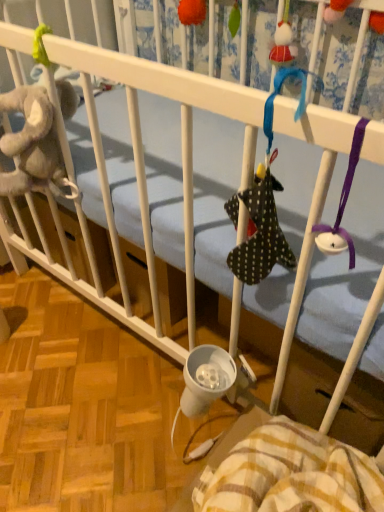
At what (x,y) coordinates should I click in order to perform the action: click on orange fuzzy ball at upper center, the first toy from the back. Please return your answer as a coordinate pair (x, y). The height and width of the screenshot is (512, 384). Looking at the image, I should click on (192, 12).

Describe the element at coordinates (192, 12) in the screenshot. The height and width of the screenshot is (512, 384). I see `orange fuzzy ball at upper center, the 2th toy when ordered from front to back` at that location.

Locate an element on the screen. yellow plaid blanket at lower right is located at coordinates (291, 474).

You are a GUI agent. You are given a task and a screenshot of the screen. Output one action in this format:
    pyautogui.click(x=<x>, y=<y>)
    Task: Click on the orange fuzzy ball at upper center, the 2th toy when ordered from front to back
    This screenshot has width=384, height=512.
    Given the screenshot: What is the action you would take?
    pyautogui.click(x=192, y=12)

From the image's perspective, would you say orange fuzzy ball at upper center, marked as the second toy in a right-to-left arrangement, is positioned over yellow plaid blanket at lower right?

Yes.

Considering the relative sizes of orange fuzzy ball at upper center, placed as the second toy when sorted from bottom to top, and yellow plaid blanket at lower right in the image provided, is orange fuzzy ball at upper center, placed as the second toy when sorted from bottom to top, wider than yellow plaid blanket at lower right?

No.

From a real-world perspective, is orange fuzzy ball at upper center, the first toy from the back, beneath yellow plaid blanket at lower right?

Incorrect, from a real-world perspective, orange fuzzy ball at upper center, the first toy from the back, is higher than yellow plaid blanket at lower right.

Who is shorter, orange fuzzy ball at upper center, the 2th toy when ordered from front to back, or yellow plaid blanket at lower right?

orange fuzzy ball at upper center, the 2th toy when ordered from front to back.

Is polka dot fabric sock at upper center, the second toy positioned from the top, in contact with yellow plaid blanket at lower right?

No, polka dot fabric sock at upper center, the second toy positioned from the top, is not touching yellow plaid blanket at lower right.

Considering the relative sizes of polka dot fabric sock at upper center, the second toy from the left, and yellow plaid blanket at lower right in the image provided, is polka dot fabric sock at upper center, the second toy from the left, shorter than yellow plaid blanket at lower right?

Correct, polka dot fabric sock at upper center, the second toy from the left, is not as tall as yellow plaid blanket at lower right.

Is yellow plaid blanket at lower right surrounded by polka dot fabric sock at upper center, the second toy from the left?

That's incorrect, yellow plaid blanket at lower right is not inside polka dot fabric sock at upper center, the second toy from the left.

Based on the photo, considering the sizes of objects polka dot fabric sock at upper center, which ranks as the 2th toy in back-to-front order, and yellow plaid blanket at lower right in the image provided, who is thinner, polka dot fabric sock at upper center, which ranks as the 2th toy in back-to-front order, or yellow plaid blanket at lower right?

With smaller width is polka dot fabric sock at upper center, which ranks as the 2th toy in back-to-front order.

Looking at this image, could orange fuzzy ball at upper center, which is counted as the 1th toy, starting from the top, be considered to be inside polka dot fabric sock at upper center, which ranks as the 2th toy in back-to-front order?

Definitely not — orange fuzzy ball at upper center, which is counted as the 1th toy, starting from the top, is not inside polka dot fabric sock at upper center, which ranks as the 2th toy in back-to-front order.

Between polka dot fabric sock at upper center, the second toy positioned from the top, and orange fuzzy ball at upper center, the 2th toy when ordered from front to back, which one appears on the right side from the viewer's perspective?

polka dot fabric sock at upper center, the second toy positioned from the top, is more to the right.

Is polka dot fabric sock at upper center, the second toy from the left, in front of orange fuzzy ball at upper center, the first toy from the back?

Yes, the depth of polka dot fabric sock at upper center, the second toy from the left, is less than that of orange fuzzy ball at upper center, the first toy from the back.

Could you tell me if polka dot fabric sock at upper center, which is counted as the 1th toy, starting from the front, is turned towards orange fuzzy ball at upper center, the 2th toy when ordered from front to back?

No, polka dot fabric sock at upper center, which is counted as the 1th toy, starting from the front, is not oriented towards orange fuzzy ball at upper center, the 2th toy when ordered from front to back.

Is polka dot fabric sock at upper center, the second toy positioned from the top, at the back of orange fuzzy ball at upper center, the first toy positioned from the left?

orange fuzzy ball at upper center, the first toy positioned from the left, is not turned away from polka dot fabric sock at upper center, the second toy positioned from the top.

From the picture: Is orange fuzzy ball at upper center, the first toy from the back, far from polka dot fabric sock at upper center, the first toy ordered from the bottom?

No, there isn't a large distance between orange fuzzy ball at upper center, the first toy from the back, and polka dot fabric sock at upper center, the first toy ordered from the bottom.

Is orange fuzzy ball at upper center, which is counted as the 1th toy, starting from the top, to the left of polka dot fabric sock at upper center, the second toy positioned from the top, from the viewer's perspective?

Indeed, orange fuzzy ball at upper center, which is counted as the 1th toy, starting from the top, is positioned on the left side of polka dot fabric sock at upper center, the second toy positioned from the top.

Which object is further away from the camera taking this photo, orange fuzzy ball at upper center, which is counted as the 1th toy, starting from the top, or polka dot fabric sock at upper center, the second toy from the left?

orange fuzzy ball at upper center, which is counted as the 1th toy, starting from the top, is behind.

Is yellow plaid blanket at lower right thinner than orange fuzzy ball at upper center, placed as the second toy when sorted from bottom to top?

No.

Considering the sizes of objects yellow plaid blanket at lower right and orange fuzzy ball at upper center, marked as the second toy in a right-to-left arrangement, in the image provided, who is bigger, yellow plaid blanket at lower right or orange fuzzy ball at upper center, marked as the second toy in a right-to-left arrangement,?

yellow plaid blanket at lower right.

Locate an element on the screen. This screenshot has width=384, height=512. the 2nd toy positioned above the yellow plaid blanket at lower right (from a real-world perspective) is located at coordinates (192, 12).

Which is more to the left, yellow plaid blanket at lower right or polka dot fabric sock at upper center, which ranks as the 2th toy in back-to-front order?

yellow plaid blanket at lower right.

From the image's perspective, is yellow plaid blanket at lower right located beneath polka dot fabric sock at upper center, the first toy ordered from the bottom?

Indeed, from the image's perspective, yellow plaid blanket at lower right is shown beneath polka dot fabric sock at upper center, the first toy ordered from the bottom.

Is yellow plaid blanket at lower right inside the boundaries of polka dot fabric sock at upper center, which ranks as the 2th toy in back-to-front order, or outside?

yellow plaid blanket at lower right cannot be found inside polka dot fabric sock at upper center, which ranks as the 2th toy in back-to-front order.

Identify the location of blanket below the orange fuzzy ball at upper center, the first toy positioned from the left (from the image's perspective). The width and height of the screenshot is (384, 512). (291, 474).

From a real-world perspective, starting from the yellow plaid blanket at lower right, which toy is the 1st one vertically above it? Please provide its 2D coordinates.

[(335, 10)]

When comparing their distances from orange fuzzy ball at upper center, the 2th toy when ordered from front to back, does yellow plaid blanket at lower right or polka dot fabric sock at upper center, which is counted as the 1th toy, starting from the front, seem further?

yellow plaid blanket at lower right.

Based on their spatial positions, is yellow plaid blanket at lower right or orange fuzzy ball at upper center, the first toy from the back, closer to polka dot fabric sock at upper center, which is counted as the 1th toy, starting from the front?

The object closer to polka dot fabric sock at upper center, which is counted as the 1th toy, starting from the front, is orange fuzzy ball at upper center, the first toy from the back.

Estimate the real-world distances between objects in this image. Which object is closer to yellow plaid blanket at lower right, orange fuzzy ball at upper center, the 2th toy when ordered from front to back, or polka dot fabric sock at upper center, the first toy ordered from the bottom?

polka dot fabric sock at upper center, the first toy ordered from the bottom, is closer to yellow plaid blanket at lower right.

Estimate the real-world distances between objects in this image. Which object is closer to yellow plaid blanket at lower right, polka dot fabric sock at upper center, which ranks as the 2th toy in back-to-front order, or orange fuzzy ball at upper center, the first toy from the back?

polka dot fabric sock at upper center, which ranks as the 2th toy in back-to-front order.

From the image, which object appears to be farther from polka dot fabric sock at upper center, the second toy from the left, orange fuzzy ball at upper center, which is counted as the 1th toy, starting from the top, or yellow plaid blanket at lower right?

yellow plaid blanket at lower right is positioned further to the anchor polka dot fabric sock at upper center, the second toy from the left.

From the image, which object appears to be farther from orange fuzzy ball at upper center, which is counted as the 1th toy, starting from the top, polka dot fabric sock at upper center, acting as the first toy starting from the right, or yellow plaid blanket at lower right?

yellow plaid blanket at lower right is further to orange fuzzy ball at upper center, which is counted as the 1th toy, starting from the top.

Find the location of `toy between orange fuzzy ball at upper center, the first toy positioned from the left, and yellow plaid blanket at lower right, in the vertical direction`. toy between orange fuzzy ball at upper center, the first toy positioned from the left, and yellow plaid blanket at lower right, in the vertical direction is located at coordinates (335, 10).